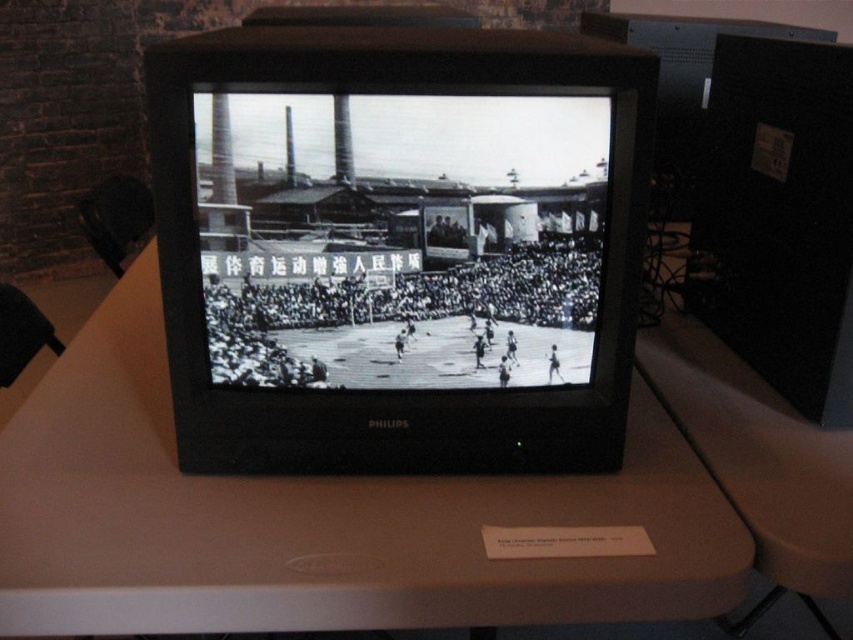
You are setting up a new lamp next to the white matte table at center and the black and white basketball court at center. Considering their heights, which object will the lamp need to be placed higher to reach the same level as the taller one?

The white matte table at center has a greater height compared to black and white basketball court at center, so the lamp should be placed higher to match the height of the white matte table at center.

You are standing in front of the vintage Philips CRT television set. You notice the white matte table at center and the black and white basketball court at center. Which object is positioned to the left?

The white matte table at center is to the left of the black and white basketball court at center, so the white matte table at center is positioned to the left.

You are standing in front of the vintage Philips CRT television set on the light colored table. There is a point at coordinates (317,518). Where is this point located?

The point at coordinates (317,518) is located on the white matte table at center.